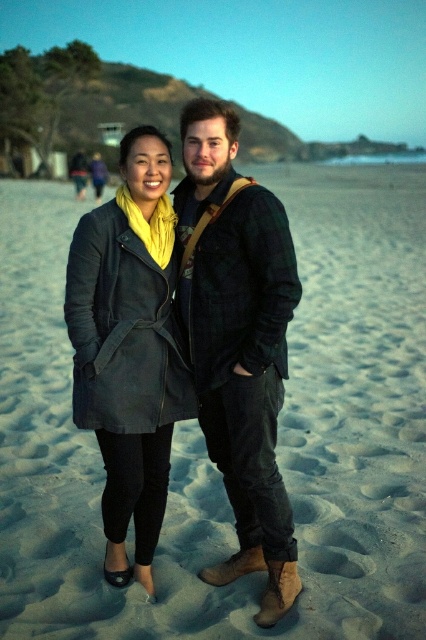
Does flannel shirt at center have a lesser width compared to matte black coat at center?

Indeed, flannel shirt at center has a lesser width compared to matte black coat at center.

Identify the location of flannel shirt at center. (238, 340).

Can you confirm if sandy beach at center is bigger than matte black coat at center?

Indeed, sandy beach at center has a larger size compared to matte black coat at center.

Does point (184, 515) come behind point (112, 483)?

Yes, point (184, 515) is behind point (112, 483).

Where is `sandy beach at center`? The width and height of the screenshot is (426, 640). sandy beach at center is located at coordinates (203, 436).

Which is above, sandy beach at center or flannel shirt at center?

sandy beach at center

Does sandy beach at center appear on the right side of flannel shirt at center?

Yes, sandy beach at center is to the right of flannel shirt at center.

Who is more forward, (374, 625) or (267, 244)?

Point (374, 625) is more forward.

I want to click on sandy beach at center, so click(x=203, y=436).